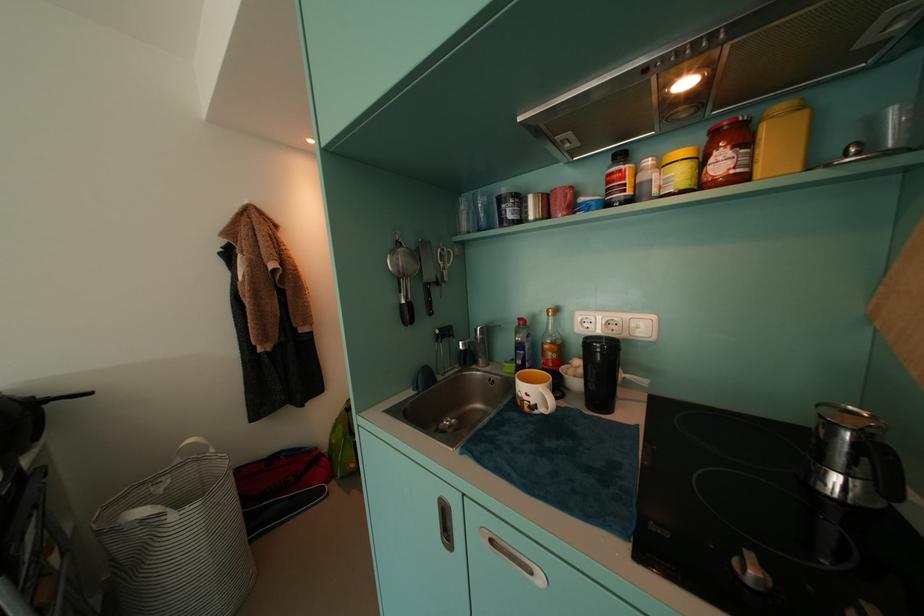
Where would you push the range hood button? Please return your answer as a coordinate pair (x, y).

(699, 43)